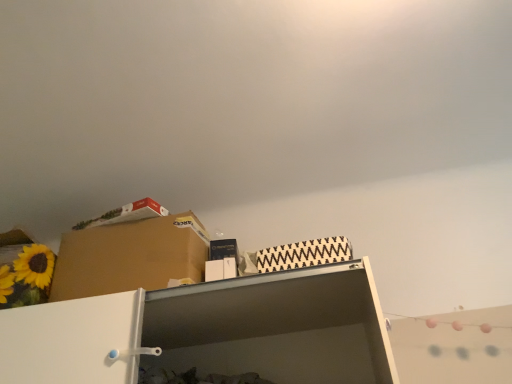
Question: Can you confirm if brown cardboard box at upper left is wider than white matte shelf at upper center?

Choices:
 (A) no
 (B) yes

Answer: (A)

Question: From a real-world perspective, is brown cardboard box at upper left positioned under white matte shelf at upper center based on gravity?

Choices:
 (A) no
 (B) yes

Answer: (A)

Question: Does brown cardboard box at upper left have a greater height compared to white matte shelf at upper center?

Choices:
 (A) no
 (B) yes

Answer: (B)

Question: From a real-world perspective, is brown cardboard box at upper left physically above white matte shelf at upper center?

Choices:
 (A) no
 (B) yes

Answer: (B)

Question: From the image's perspective, is brown cardboard box at upper left on top of white matte shelf at upper center?

Choices:
 (A) no
 (B) yes

Answer: (B)

Question: From the image's perspective, does brown cardboard box at upper left appear lower than white matte shelf at upper center?

Choices:
 (A) no
 (B) yes

Answer: (A)

Question: From the image's perspective, is white matte shelf at upper center above brown cardboard box at upper left?

Choices:
 (A) no
 (B) yes

Answer: (A)

Question: Is white matte shelf at upper center not close to brown cardboard box at upper left?

Choices:
 (A) no
 (B) yes

Answer: (A)

Question: Can we say white matte shelf at upper center lies outside brown cardboard box at upper left?

Choices:
 (A) no
 (B) yes

Answer: (B)

Question: From the image's perspective, is white matte shelf at upper center below brown cardboard box at upper left?

Choices:
 (A) no
 (B) yes

Answer: (B)

Question: Is white matte shelf at upper center taller than brown cardboard box at upper left?

Choices:
 (A) no
 (B) yes

Answer: (A)

Question: Is white matte shelf at upper center positioned in front of brown cardboard box at upper left?

Choices:
 (A) yes
 (B) no

Answer: (A)

Question: From a real-world perspective, is brown cardboard box at upper left positioned above or below white matte shelf at upper center?

Choices:
 (A) below
 (B) above

Answer: (B)